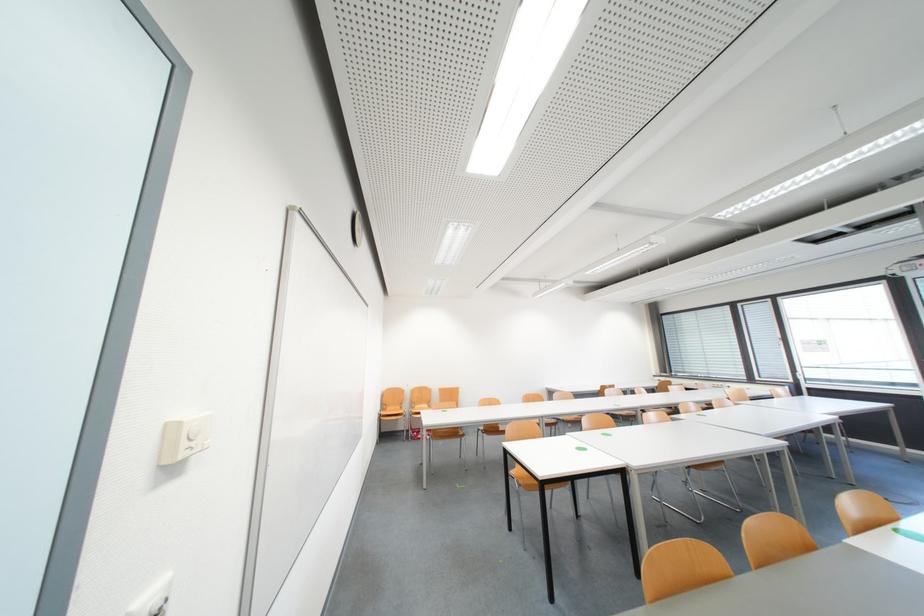
At what (x,y) coordinates should I click in order to perform the action: click on orange chair sitting surface. Please return your answer as a coordinate pair (x, y). The width and height of the screenshot is (924, 616). Looking at the image, I should click on (391, 414).